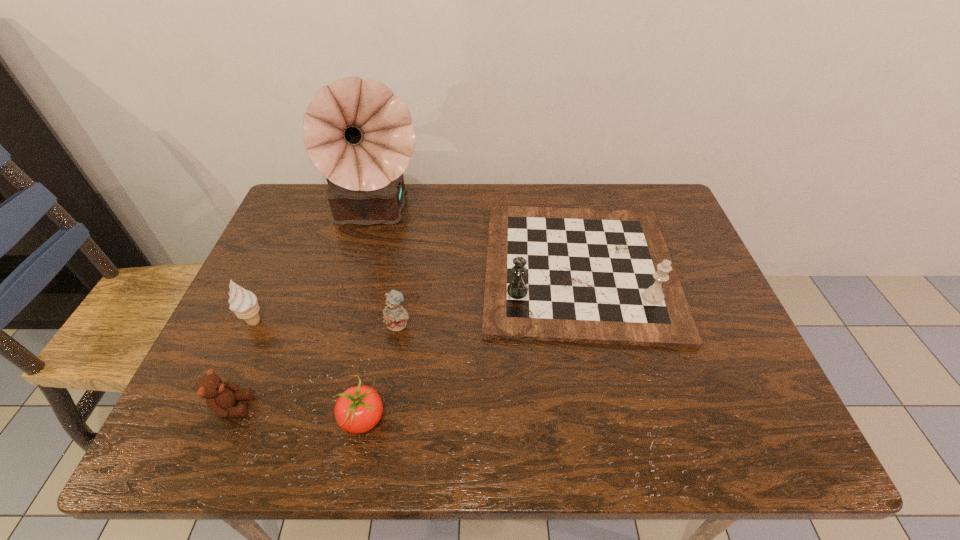
This screenshot has width=960, height=540. In order to click on blank space that satisfies the following two spatial constraints: 1. from the horn of the record player; 2. on the front-facing side of the icecream in this screenshot , I will do `click(346, 322)`.

At what (x,y) coordinates should I click in order to perform the action: click on free space that satisfies the following two spatial constraints: 1. on the front-facing side of the farther teddy bear; 2. on the face of the left teddy bear. Please return your answer as a coordinate pair (x, y). Looking at the image, I should click on point(386,407).

Image resolution: width=960 pixels, height=540 pixels. What are the coordinates of `vacant space that satisfies the following two spatial constraints: 1. on the face of the shortest object; 2. on the left side of the left teddy bear` in the screenshot? It's located at (228, 419).

Locate an element on the screen. Image resolution: width=960 pixels, height=540 pixels. vacant space that satisfies the following two spatial constraints: 1. on the face of the tomato; 2. on the right side of the nearer teddy bear is located at coordinates (228, 419).

Where is `vacant space that satisfies the following two spatial constraints: 1. from the horn of the tallest object; 2. on the front-facing side of the icecream`? This screenshot has height=540, width=960. vacant space that satisfies the following two spatial constraints: 1. from the horn of the tallest object; 2. on the front-facing side of the icecream is located at coordinates (346, 322).

Where is `vacant space that satisfies the following two spatial constraints: 1. from the horn of the record player; 2. on the left side of the shortest object`? This screenshot has width=960, height=540. vacant space that satisfies the following two spatial constraints: 1. from the horn of the record player; 2. on the left side of the shortest object is located at coordinates coord(320,419).